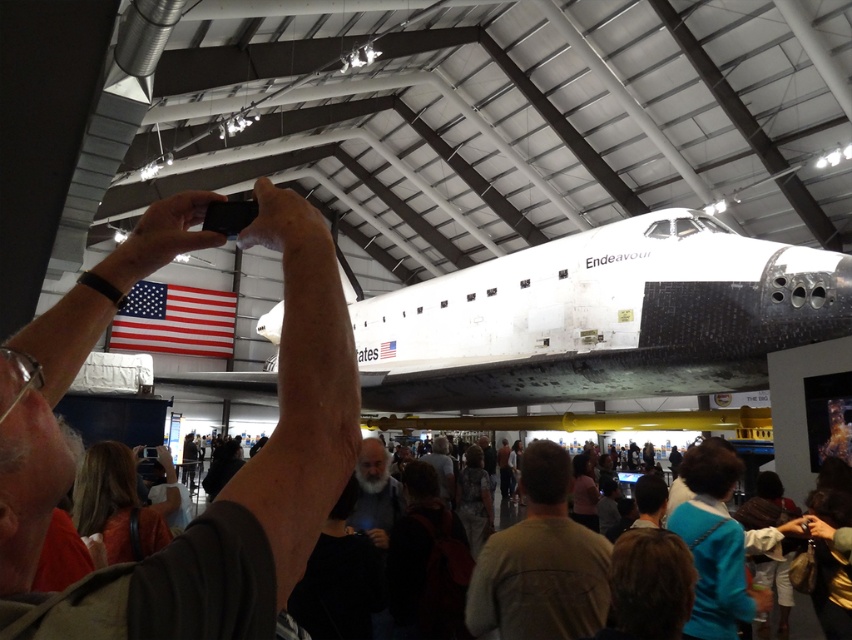
Is matte black phone at upper center to the right of white matte space shuttle at center from the viewer's perspective?

Incorrect, matte black phone at upper center is not on the right side of white matte space shuttle at center.

The width and height of the screenshot is (852, 640). What do you see at coordinates (220, 490) in the screenshot? I see `matte black phone at upper center` at bounding box center [220, 490].

Does point (44, 504) come behind point (763, 275)?

No, (44, 504) is closer to viewer.

This screenshot has width=852, height=640. In order to click on matte black phone at upper center in this screenshot , I will do `click(220, 490)`.